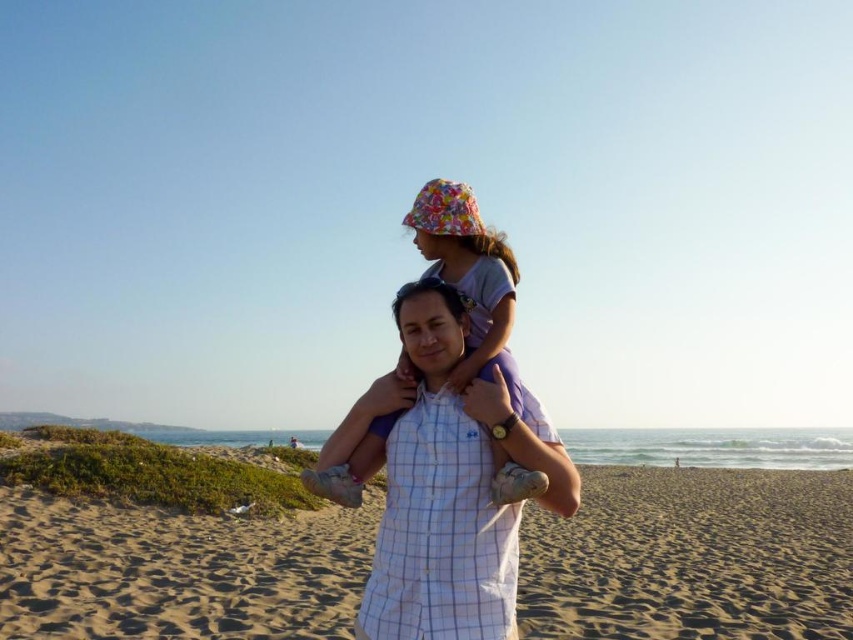
Question: Does sandy yellow sand at center appear over floral fabric hat at center?

Choices:
 (A) no
 (B) yes

Answer: (A)

Question: Which point appears farthest from the camera in this image?

Choices:
 (A) (447, 275)
 (B) (410, 428)

Answer: (A)

Question: Which point appears closest to the camera in this image?

Choices:
 (A) (489, 417)
 (B) (473, 324)
 (C) (573, 518)

Answer: (A)

Question: Among these points, which one is nearest to the camera?

Choices:
 (A) (477, 394)
 (B) (830, 468)
 (C) (374, 436)

Answer: (A)

Question: Can you confirm if sandy yellow sand at center is thinner than floral fabric hat at center?

Choices:
 (A) no
 (B) yes

Answer: (A)

Question: Can you confirm if white checkered shirt at center is bigger than floral fabric hat at center?

Choices:
 (A) yes
 (B) no

Answer: (B)